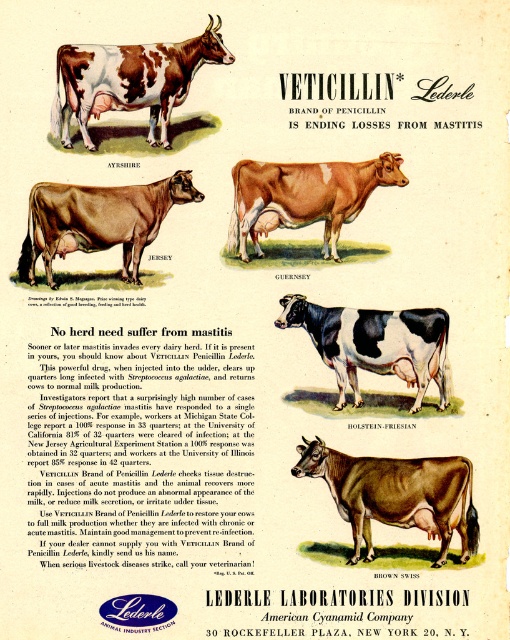
Does brown glossy holstein-friesian at center appear over brown glossy cow at center?

Incorrect, brown glossy holstein-friesian at center is not positioned above brown glossy cow at center.

Between brown glossy holstein-friesian at center and brown glossy cow at center, which one is positioned lower?

brown glossy holstein-friesian at center is below.

Does point (435, 488) come farther from viewer compared to point (237, 177)?

That is False.

Locate an element on the screen. This screenshot has height=640, width=510. brown glossy holstein-friesian at center is located at coordinates (x=396, y=493).

Is brown glossy holstein-friesian at center wider than black and white holstein-friesian at center?

Correct, the width of brown glossy holstein-friesian at center exceeds that of black and white holstein-friesian at center.

Does brown glossy holstein-friesian at center have a smaller size compared to black and white holstein-friesian at center?

Incorrect, brown glossy holstein-friesian at center is not smaller in size than black and white holstein-friesian at center.

The height and width of the screenshot is (640, 510). Describe the element at coordinates (396, 493) in the screenshot. I see `brown glossy holstein-friesian at center` at that location.

The image size is (510, 640). Identify the location of brown glossy holstein-friesian at center. (396, 493).

Between brown spotted cow at center and black and white holstein-friesian at center, which one appears on the right side from the viewer's perspective?

black and white holstein-friesian at center

Who is lower down, brown spotted cow at center or black and white holstein-friesian at center?

black and white holstein-friesian at center

Where is `brown spotted cow at center`? The image size is (510, 640). brown spotted cow at center is located at coordinates (130, 81).

The image size is (510, 640). Find the location of `brown spotted cow at center`. brown spotted cow at center is located at coordinates (130, 81).